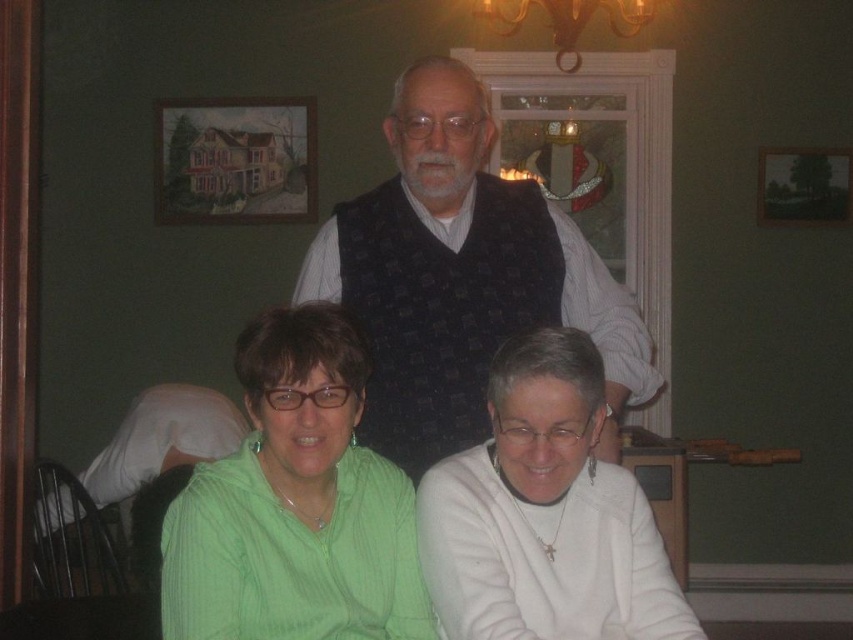
Between point (462, 273) and point (305, 540), which one is positioned in front?

Point (305, 540) is in front.

Where is `dark blue textured vest at center`? Image resolution: width=853 pixels, height=640 pixels. dark blue textured vest at center is located at coordinates (461, 276).